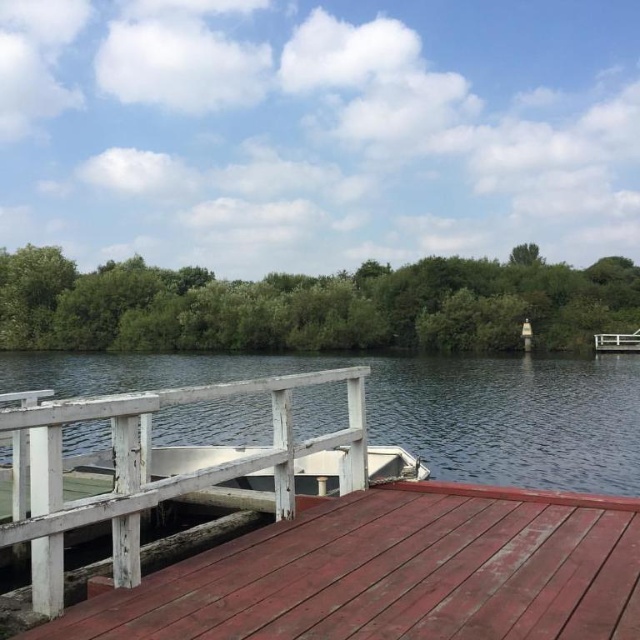
Between point (410, 369) and point (113, 424), which one is positioned in front?

Point (113, 424)

Is point (132, 365) closer to viewer compared to point (81, 419)?

That is False.

What do you see at coordinates (424, 406) in the screenshot?
I see `clear water at dock center` at bounding box center [424, 406].

Locate an element on the screen. clear water at dock center is located at coordinates (424, 406).

Is point (308, 564) less distant than point (134, 403)?

No.

This screenshot has height=640, width=640. Find the location of `rustic wood deck at center`. rustic wood deck at center is located at coordinates (396, 573).

Who is higher up, rustic wood deck at center or clear water at dock center?

Positioned higher is rustic wood deck at center.

The width and height of the screenshot is (640, 640). Find the location of `rustic wood deck at center`. rustic wood deck at center is located at coordinates (396, 573).